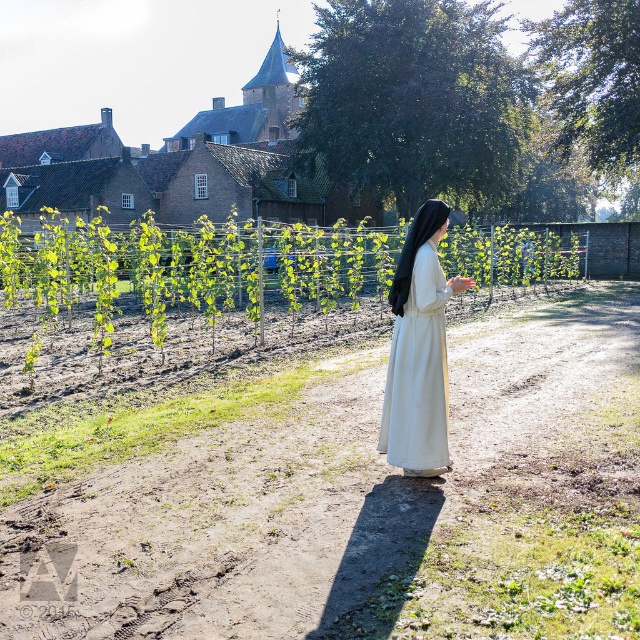
You are a photographer trying to capture a closeup of the white cotton dress at center without the green leafy vine at center overlapping it. Given their widths, is this feasible?

The green leafy vine at center is wider than the white cotton dress at center, so it might block the dress if positioned closely. Adjust the angle or move slightly to ensure the narrower dress is framed without obstruction.

You are a photographer standing at the edge of the garden. You want to take a closeup shot of the green leafy vine at center without moving the nun. Can you estimate how far you need to move towards the vine to get a better closeup?

The green leafy vine at center is 26.24 feet away from the camera. To get a closer shot, you would need to move approximately 26.24 feet towards the vine to reach it, but since you can adjust your camera settings or zoom instead of moving, you might not need to move that distance. However, if moving is necessary, moving closer would reduce the distance.